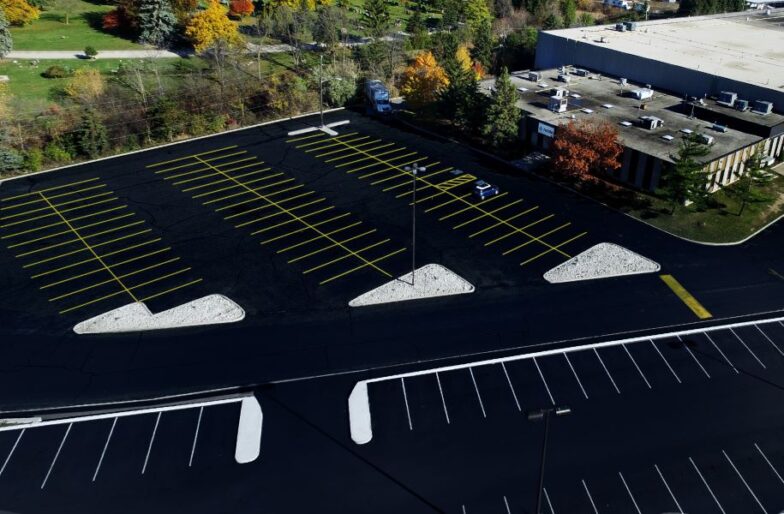
Identify the location of skylights. (622, 122), (662, 140), (683, 128), (610, 101), (586, 111), (579, 93), (546, 85), (523, 88).